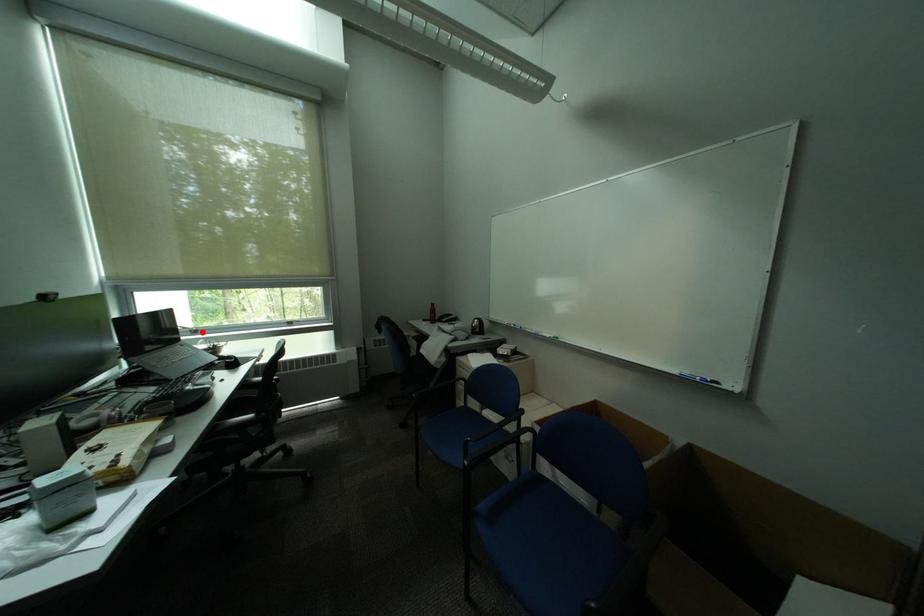
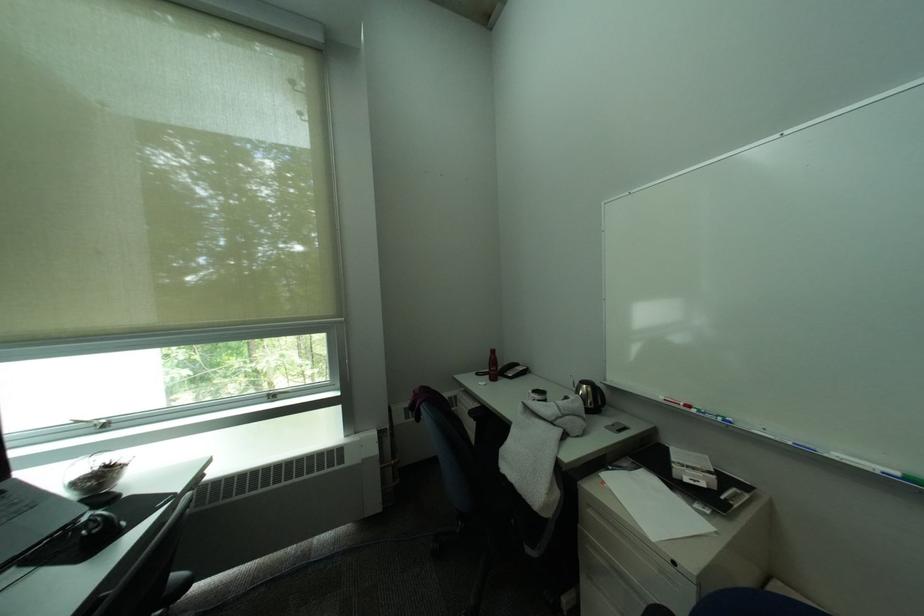
Where in the second image is the point corresponding to the highlighted location from the first image?

(106, 427)